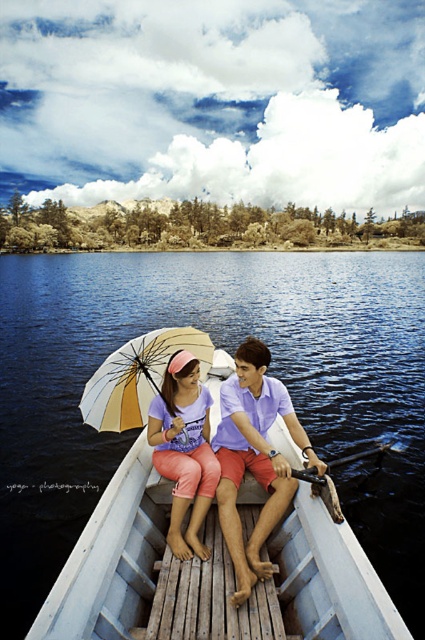
Question: Can you confirm if matte purple shirt at center is thinner than yellow and white striped umbrella at center?

Choices:
 (A) no
 (B) yes

Answer: (B)

Question: Which point is farther from the camera taking this photo?

Choices:
 (A) (379, 387)
 (B) (288, 502)
 (C) (150, 376)
 (D) (198, 541)

Answer: (A)

Question: Is matte purple shirt at center bigger than yellow and white striped umbrella at center?

Choices:
 (A) no
 (B) yes

Answer: (A)

Question: Which is nearer to the yellow and white striped umbrella at center?

Choices:
 (A) matte purple shirt at center
 (B) blue water at center

Answer: (A)

Question: Which object is the farthest from the matte purple shirt at center?

Choices:
 (A) matte pink shorts at center
 (B) yellow and white striped umbrella at center
 (C) blue water at center

Answer: (C)

Question: Does matte pink shorts at center appear on the right side of yellow and white striped umbrella at center?

Choices:
 (A) no
 (B) yes

Answer: (B)